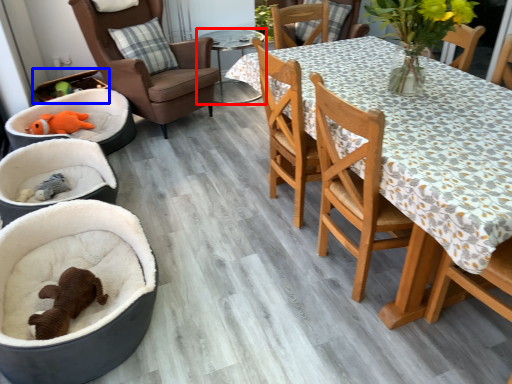
Question: Which object appears farthest to the camera in this image, table (highlighted by a red box) or laundry basket (highlighted by a blue box)?

Choices:
 (A) table
 (B) laundry basket

Answer: (A)